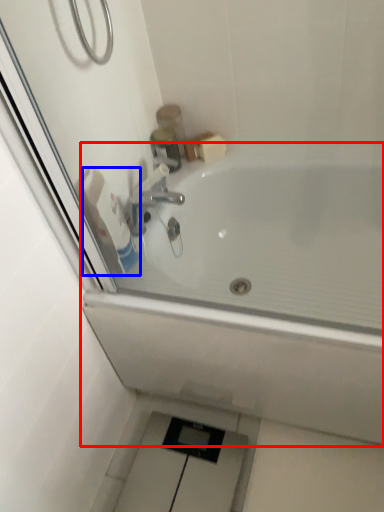
Question: Among these objects, which one is nearest to the camera, bathtub (highlighted by a red box) or toilet paper (highlighted by a blue box)?

Choices:
 (A) bathtub
 (B) toilet paper

Answer: (A)